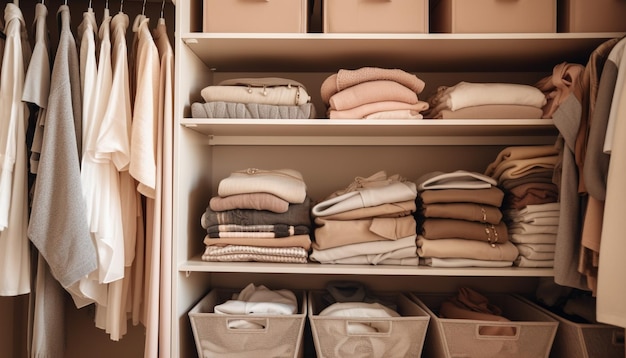
Locate an element on the screen. The height and width of the screenshot is (358, 626). clothes on hangers on the right is located at coordinates (592, 66), (608, 70), (620, 113), (568, 157).